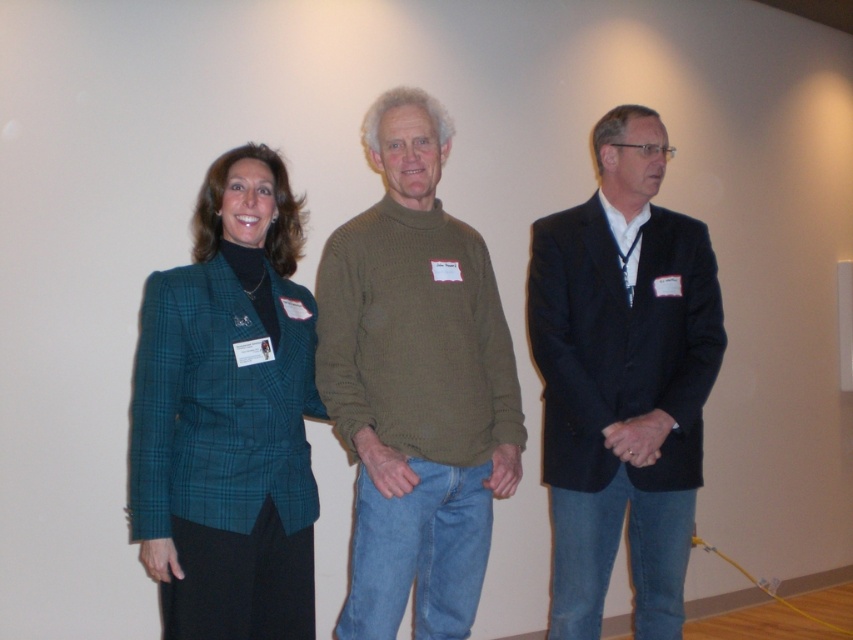
Question: Is the position of knit green sweater at center less distant than that of dark blue suit at center?

Choices:
 (A) yes
 (B) no

Answer: (A)

Question: Does knit green sweater at center appear under dark blue suit at center?

Choices:
 (A) no
 (B) yes

Answer: (A)

Question: Which point is farther from the camera taking this photo?

Choices:
 (A) (613, 518)
 (B) (213, 417)

Answer: (A)

Question: Estimate the real-world distances between objects in this image. Which object is farther from the teal plaid blazer at center?

Choices:
 (A) knit green sweater at center
 (B) dark blue suit at center

Answer: (B)

Question: Is teal plaid blazer at center to the right of dark blue suit at center from the viewer's perspective?

Choices:
 (A) no
 (B) yes

Answer: (A)

Question: Which object is closer to the camera taking this photo?

Choices:
 (A) knit green sweater at center
 (B) teal plaid blazer at center
 (C) dark blue suit at center

Answer: (B)